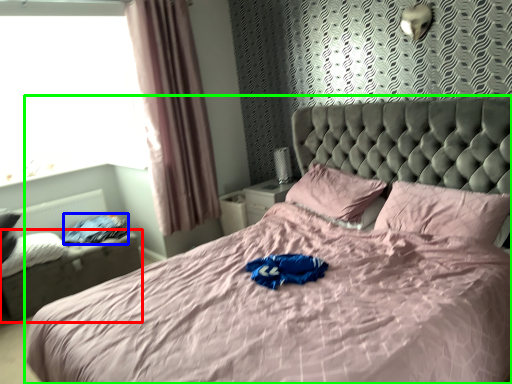
Question: Based on their relative distances, which object is nearer to footrest (highlighted by a red box)? Choose from clothing (highlighted by a blue box) and bed (highlighted by a green box).

Choices:
 (A) clothing
 (B) bed

Answer: (A)